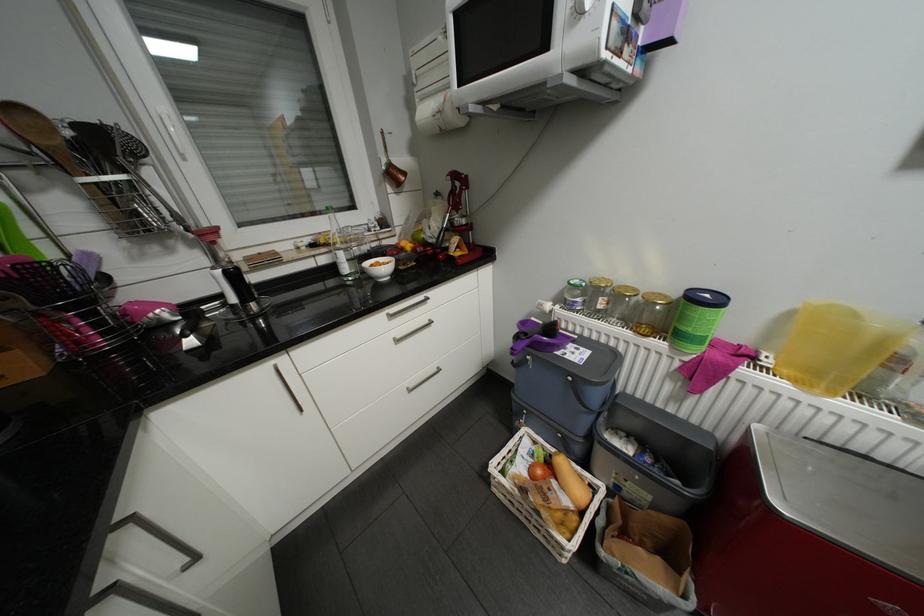
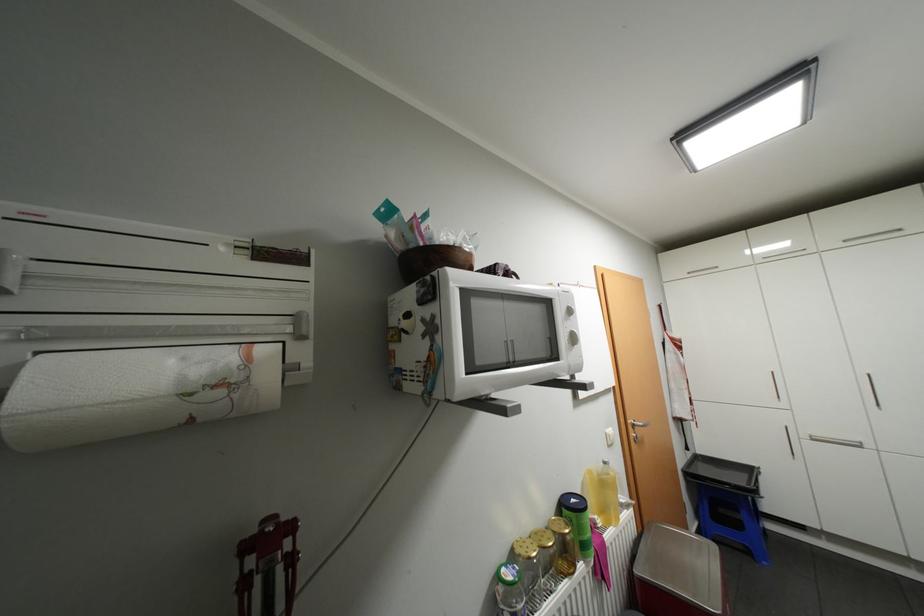
Find the pixel in the second image that matches point 775,361 in the first image.

(606, 521)